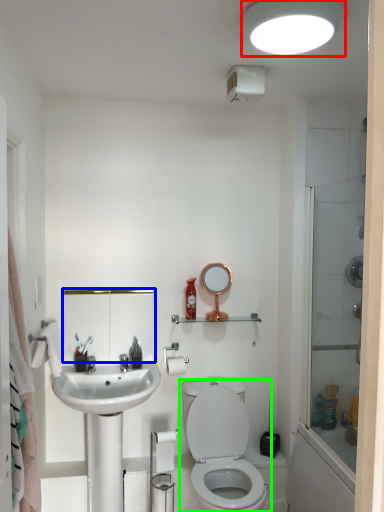
Question: Which object is the farthest from light fixture (highlighted by a red box)? Choose among these: medicine cabinet (highlighted by a blue box) or toilet (highlighted by a green box).

Choices:
 (A) medicine cabinet
 (B) toilet

Answer: (B)